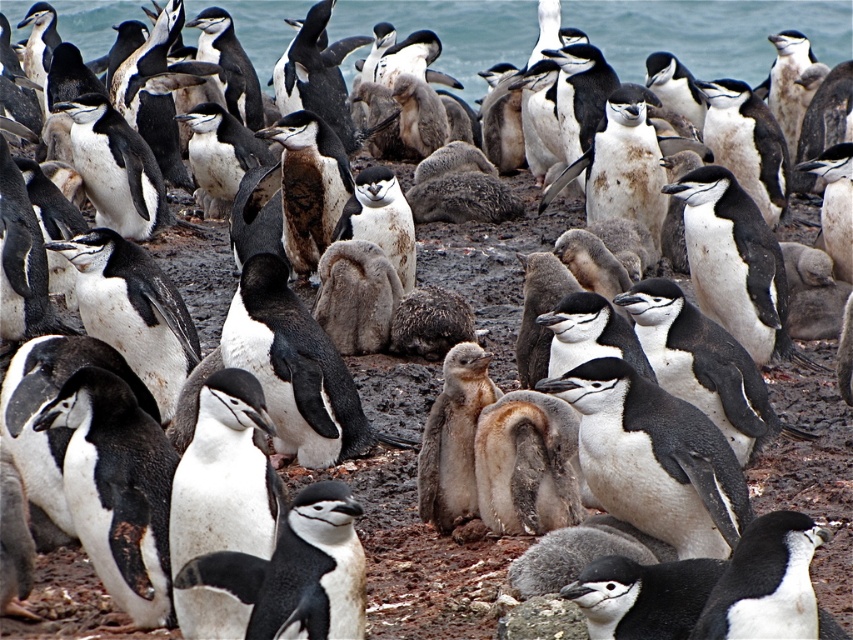
Which of these two, blue water at upper center or white matte penguin at center, stands taller?

With more height is blue water at upper center.

The height and width of the screenshot is (640, 853). What do you see at coordinates (708, 33) in the screenshot? I see `blue water at upper center` at bounding box center [708, 33].

Locate an element on the screen. This screenshot has height=640, width=853. blue water at upper center is located at coordinates click(708, 33).

At what (x,y) coordinates should I click in order to perform the action: click on blue water at upper center. Please return your answer as a coordinate pair (x, y). The width and height of the screenshot is (853, 640). Looking at the image, I should click on (708, 33).